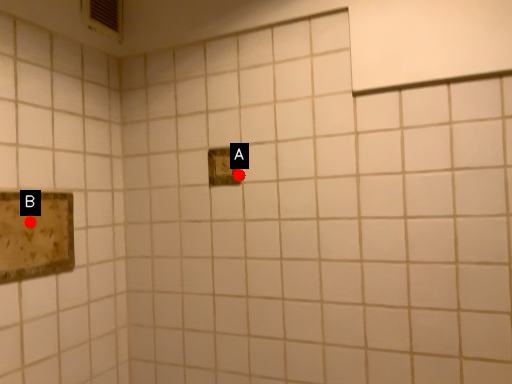
Question: Two points are circled on the image, labeled by A and B beside each circle. Among these points, which one is farthest from the camera?

Choices:
 (A) A is further
 (B) B is further

Answer: (A)